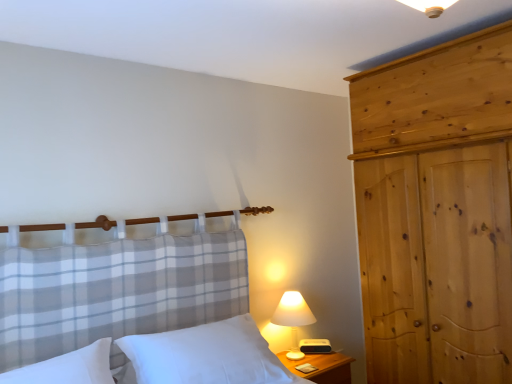
Locate an element on the screen. Image resolution: width=512 pixels, height=384 pixels. white fabric lampshade at right is located at coordinates (293, 319).

I want to click on white soft pillow at lower left, so click(x=68, y=368).

From the image's perspective, does white fabric lampshade at right appear higher than white soft pillow at center?

No, from the image's perspective, white fabric lampshade at right is not on top of white soft pillow at center.

Based on the photo, which of these two, white fabric lampshade at right or white soft pillow at center, is bigger?

Bigger between the two is white soft pillow at center.

In the scene shown: From a real-world perspective, is white fabric lampshade at right on top of white soft pillow at center?

No, from a real-world perspective, white fabric lampshade at right is not on top of white soft pillow at center.

Is white fabric lampshade at right inside or outside of natural wood wardrobe at right?

white fabric lampshade at right is spatially situated outside natural wood wardrobe at right.

Is the depth of white fabric lampshade at right greater than that of natural wood wardrobe at right?

Yes, white fabric lampshade at right is further from the camera.

Is there a large distance between white fabric lampshade at right and natural wood wardrobe at right?

white fabric lampshade at right is actually quite close to natural wood wardrobe at right.

Who is bigger, white soft pillow at center or white fabric lampshade at right?

Bigger between the two is white soft pillow at center.

This screenshot has height=384, width=512. Find the location of `table lamp behind the white soft pillow at center`. table lamp behind the white soft pillow at center is located at coordinates (293, 319).

Is white soft pillow at center oriented away from white fabric lampshade at right?

No, white soft pillow at center is not facing away from white fabric lampshade at right.

Between white soft pillow at center and white fabric lampshade at right, which one appears on the left side from the viewer's perspective?

white soft pillow at center is more to the left.

Based on the photo, is wooden at right in contact with natural wood wardrobe at right?

wooden at right and natural wood wardrobe at right are clearly separated.

From the image's perspective, which is above, wooden at right or natural wood wardrobe at right?

natural wood wardrobe at right appears higher in the image.

Is natural wood wardrobe at right at the back of wooden at right?

No, wooden at right's orientation is not away from natural wood wardrobe at right.

This screenshot has height=384, width=512. Identify the location of dresser located above the wooden at right (from the image's perspective). (435, 210).

Is there a large distance between wooden at right and white soft pillow at lower left?

Yes, wooden at right and white soft pillow at lower left are quite far apart.

Does wooden at right appear on the right side of white soft pillow at lower left?

Indeed, wooden at right is positioned on the right side of white soft pillow at lower left.

Does wooden at right have a lesser width compared to white soft pillow at lower left?

No.

Is natural wood wardrobe at right positioned with its back to white soft pillow at center?

No, white soft pillow at center is not at the back of natural wood wardrobe at right.

Can you confirm if natural wood wardrobe at right is wider than white soft pillow at center?

Yes.

From the image's perspective, which one is positioned lower, natural wood wardrobe at right or white soft pillow at center?

white soft pillow at center is shown below in the image.

Does natural wood wardrobe at right come in front of white soft pillow at center?

No, the depth of natural wood wardrobe at right is greater than that of white soft pillow at center.

In the image, is wooden at right on the left side or the right side of white fabric lampshade at right?

Based on their positions, wooden at right is located to the right of white fabric lampshade at right.

From the picture: Considering the relative sizes of wooden at right and white fabric lampshade at right in the image provided, is wooden at right shorter than white fabric lampshade at right?

Yes, wooden at right is shorter than white fabric lampshade at right.

Identify the location of nightstand that is in front of the white fabric lampshade at right. The width and height of the screenshot is (512, 384). (322, 367).

Where is `bed above the white fabric lampshade at right (from the image's perspective)`? The width and height of the screenshot is (512, 384). bed above the white fabric lampshade at right (from the image's perspective) is located at coordinates (207, 355).

At what (x,y) coordinates should I click in order to perform the action: click on table lamp behind the natural wood wardrobe at right. Please return your answer as a coordinate pair (x, y). This screenshot has height=384, width=512. Looking at the image, I should click on (293, 319).

Considering their positions, is white fabric lampshade at right positioned further to white soft pillow at lower left than white soft pillow at center?

white fabric lampshade at right.

From the image, which object appears to be farther from wooden at right, white soft pillow at center or white soft pillow at lower left?

white soft pillow at lower left is positioned further to the anchor wooden at right.

Looking at the image, which one is located further to natural wood wardrobe at right, wooden at right or white fabric lampshade at right?

Among the two, wooden at right is located further to natural wood wardrobe at right.

From the image, which object appears to be farther from white soft pillow at lower left, natural wood wardrobe at right or white soft pillow at center?

natural wood wardrobe at right.

When comparing their distances from natural wood wardrobe at right, does white soft pillow at center or wooden at right seem closer?

Based on the image, wooden at right appears to be nearer to natural wood wardrobe at right.

From the image, which object appears to be nearer to white soft pillow at center, natural wood wardrobe at right or white soft pillow at lower left?

Based on the image, white soft pillow at lower left appears to be nearer to white soft pillow at center.

Looking at the image, which one is located further to white fabric lampshade at right, white soft pillow at lower left or wooden at right?

Based on the image, white soft pillow at lower left appears to be further to white fabric lampshade at right.

Estimate the real-world distances between objects in this image. Which object is closer to natural wood wardrobe at right, wooden at right or white soft pillow at center?

Based on the image, wooden at right appears to be nearer to natural wood wardrobe at right.

Where is `bed between white soft pillow at lower left and white fabric lampshade at right from front to back`? This screenshot has width=512, height=384. bed between white soft pillow at lower left and white fabric lampshade at right from front to back is located at coordinates (207, 355).

I want to click on nightstand between white soft pillow at lower left and natural wood wardrobe at right, so click(x=322, y=367).

The width and height of the screenshot is (512, 384). Identify the location of nightstand between white soft pillow at lower left and white fabric lampshade at right from front to back. (322, 367).

The height and width of the screenshot is (384, 512). What are the coordinates of `bed between white soft pillow at lower left and wooden at right` in the screenshot? It's located at (207, 355).